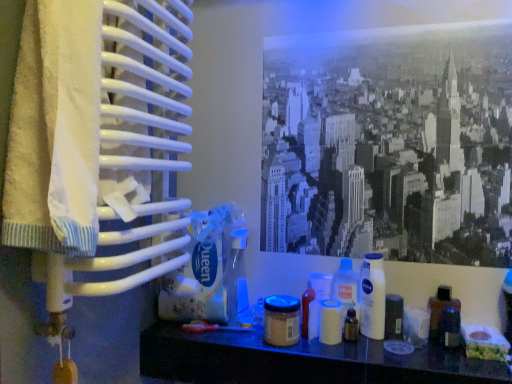
You are a GUI agent. You are given a task and a screenshot of the screen. Output one action in this format:
    pyautogui.click(x=<x>, y=<y>)
    Task: Click on the vacant space situated on the left part of brown matte jar at center, the sixth toiletry from the right
    The height and width of the screenshot is (384, 512).
    Given the screenshot: What is the action you would take?
    pyautogui.click(x=231, y=344)